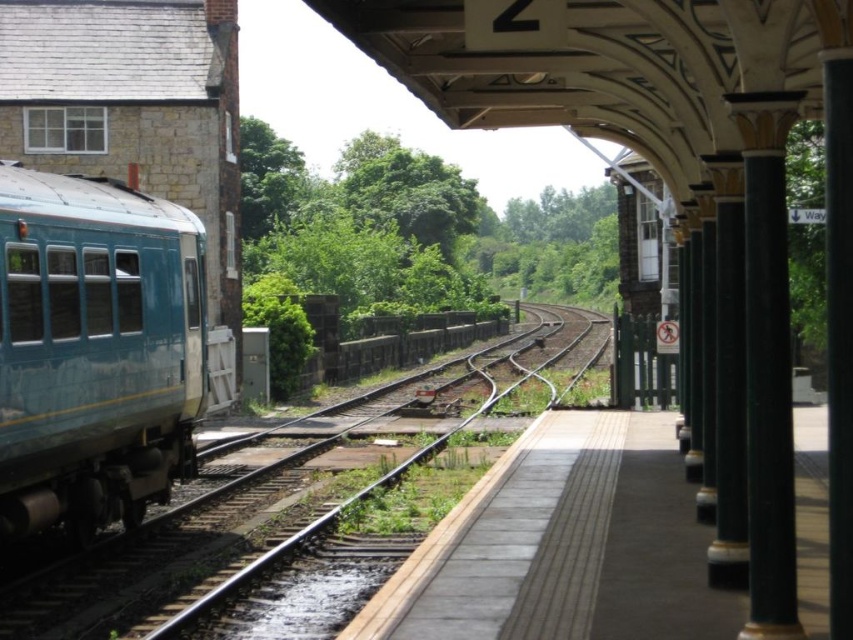
Looking at this image, you are a station attendant and need to direct a passenger to the train. The passenger is standing on the platform. Which object, the teal glossy train car at left or the green metallic train track at center, is smaller in size?

The teal glossy train car at left is smaller in size than the green metallic train track at center because it occupies less space.

Based on the photo, you are standing on the platform at the railway station. You need to walk to the green metallic train track at center. Which direction should you walk from your current position on the platform?

The green metallic train track at center is located at point coordinates, so you should walk towards the center of the platform where the tracks are positioned.

You are a maintenance worker on the platform. You need to compare the heights of the green metallic train track at center and the green polished stone column at right. Which one is taller?

The green polished stone column at right is taller than the green metallic train track at center.